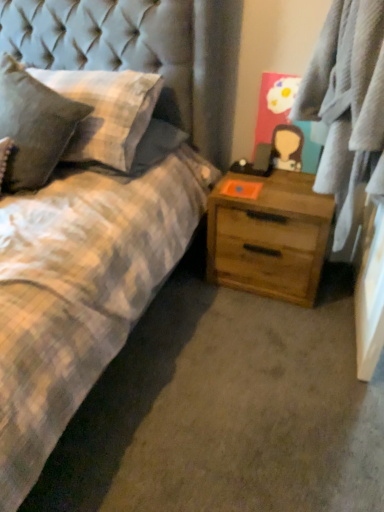
Question: In terms of width, does light brown wood chest of drawers at center-right look wider or thinner when compared to textured gray pillow at left, which appears as the first pillow when viewed from the right?

Choices:
 (A) wide
 (B) thin

Answer: (B)

Question: From a real-world perspective, is light brown wood chest of drawers at center-right above or below textured gray pillow at left, marked as the 2th pillow in a left-to-right arrangement?

Choices:
 (A) below
 (B) above

Answer: (A)

Question: Which of these objects is positioned farthest from the plaid fabric at right?

Choices:
 (A) plaid fabric pillow at left, marked as the first pillow in a left-to-right arrangement
 (B) light brown wood chest of drawers at center-right
 (C) textured gray pillow at left, which appears as the first pillow when viewed from the right

Answer: (A)

Question: Which is nearer to the textured gray pillow at left, marked as the 2th pillow in a left-to-right arrangement?

Choices:
 (A) plaid fabric at right
 (B) plaid fabric pillow at left, marked as the first pillow in a left-to-right arrangement
 (C) light brown wood chest of drawers at center-right

Answer: (B)